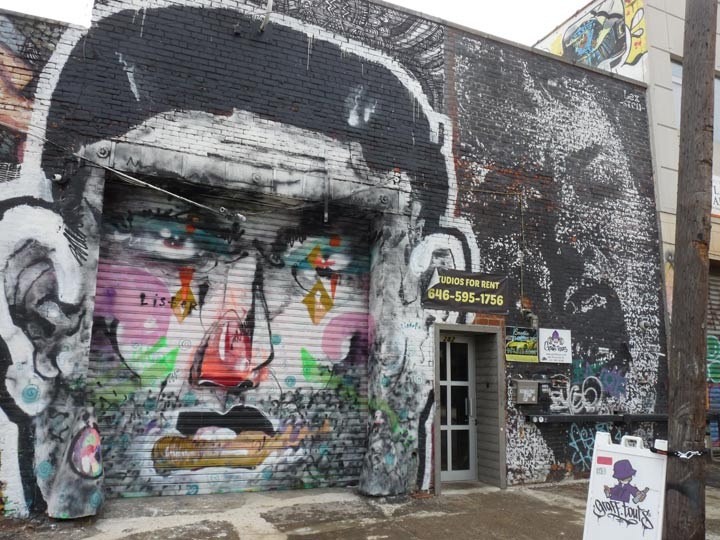
You are a GUI agent. You are given a task and a screenshot of the screen. Output one action in this format:
    pyautogui.click(x=<x>, y=<y>)
    Task: Click on the windows
    The height and width of the screenshot is (540, 720).
    Given the screenshot: What is the action you would take?
    pyautogui.click(x=454, y=359), pyautogui.click(x=444, y=357), pyautogui.click(x=458, y=399), pyautogui.click(x=444, y=404), pyautogui.click(x=459, y=449), pyautogui.click(x=444, y=452)